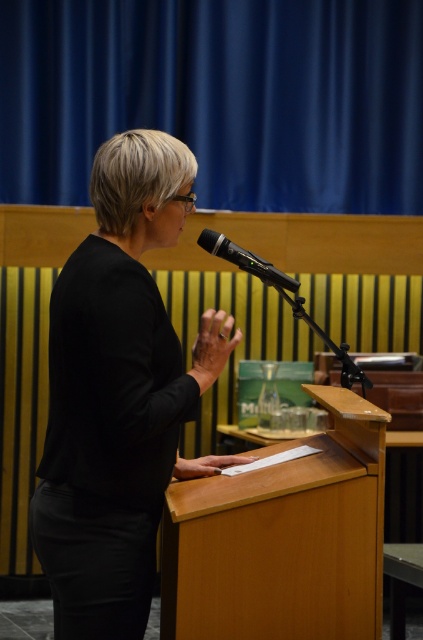
You are an attendee at the event and want to take a photo of the speaker. You notice two points in the image labeled as point (x=57, y=376) and point (x=217, y=236). Which point is closer to you?

Point (x=57, y=376) is closer to the viewer than point (x=217, y=236).

You are an event organizer setting up a video camera to capture the speaker. The camera is placed at the back of the room. You want to ensure that both the black matte shirt at center and the light brown wood podium at center are fully visible in the frame. Given their relative heights, which object might you need to adjust the camera angle to focus on more?

→ The black matte shirt at center is much taller than the light brown wood podium at center, so you might need to adjust the camera angle to focus on the black matte shirt at center to ensure it is fully visible in the frame.

You are standing in the audience and see two points on the stage. The first point is at coordinate point(x=65, y=378) and the second is at point(x=291, y=502). Which point is closer to you?

Point(x=65, y=378) is in front of point(x=291, y=502), so it is closer to you.